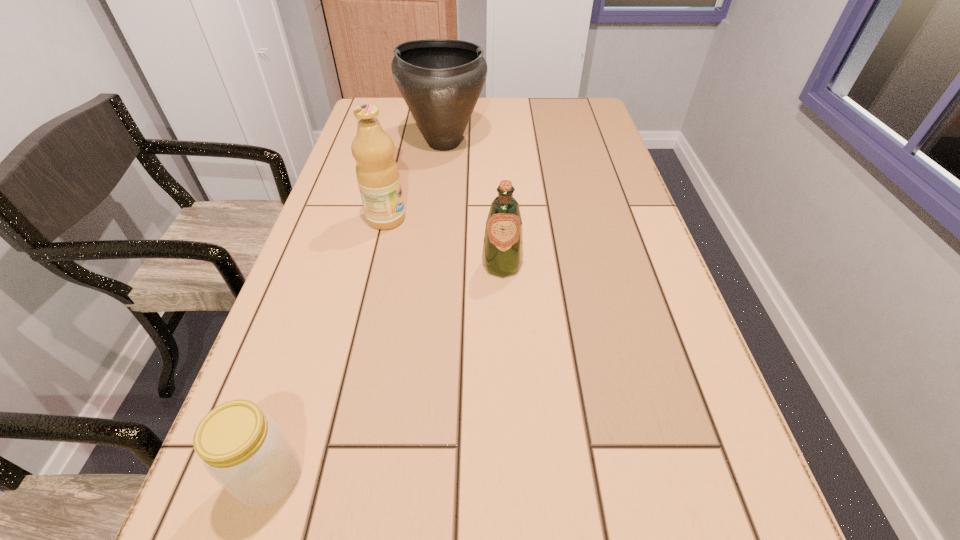
You are a GUI agent. You are given a task and a screenshot of the screen. Output one action in this format:
    pyautogui.click(x=<x>, y=<y>)
    Task: Click on the free point between the second nearest object and the shortest object
    This screenshot has width=960, height=540.
    Given the screenshot: What is the action you would take?
    pyautogui.click(x=386, y=371)

The image size is (960, 540). In order to click on vacant space that is in between the jar and the shorter olive oil in this screenshot , I will do `click(386, 371)`.

The image size is (960, 540). In order to click on free space between the nearest object and the taller olive oil in this screenshot , I will do `click(328, 348)`.

Where is `vacant space in between the nearest object and the farthest object`? The height and width of the screenshot is (540, 960). vacant space in between the nearest object and the farthest object is located at coordinates (358, 310).

Locate an element on the screen. blank region between the left olive oil and the nearer olive oil is located at coordinates (444, 242).

Locate an element on the screen. vacant space in between the farthest object and the nearer olive oil is located at coordinates (473, 204).

Where is `free area in between the urn and the right olive oil`? This screenshot has height=540, width=960. free area in between the urn and the right olive oil is located at coordinates (473, 204).

Locate an element on the screen. Image resolution: width=960 pixels, height=540 pixels. free space between the nearer olive oil and the nearest object is located at coordinates (386, 371).

Where is `blank region between the farthest object and the left olive oil`? blank region between the farthest object and the left olive oil is located at coordinates (416, 181).

Select which object is the closest to the second shortest object. Please provide its 2D coordinates. Your answer should be formatted as a tuple, i.e. [(x, y)], where the tuple contains the x and y coordinates of a point satisfying the conditions above.

[(377, 173)]